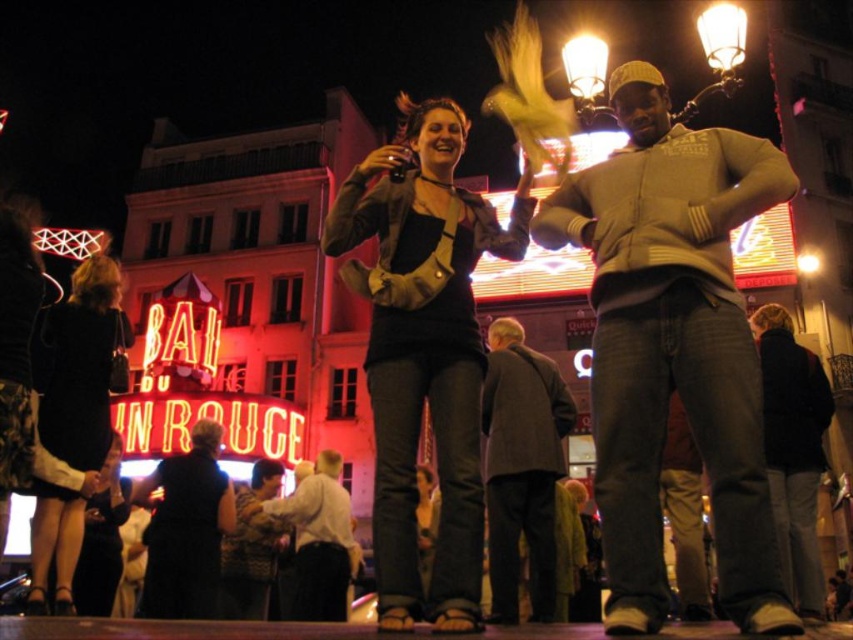
You are a photographer at the event and want to take a photo of the black dress at center and the patterned fabric dress at center. Which dress should you focus on first if you want to capture both in the frame without moving the camera?

The black dress at center is larger in size than the patterned fabric dress at center, so focusing on the black dress at center first would ensure it is properly framed before adjusting for the smaller patterned fabric dress at center.

You are a photographer standing in front of the Bau du Rouge cabaret venue. You want to take a photo of both the patterned fabric dress at center and the black leather jacket at lower left. Which object should you focus on first to ensure both are in sharp focus?

You should focus on the patterned fabric dress at center first because it is closer to you than the black leather jacket at lower left, so focusing on the closer object will help ensure both are in focus.